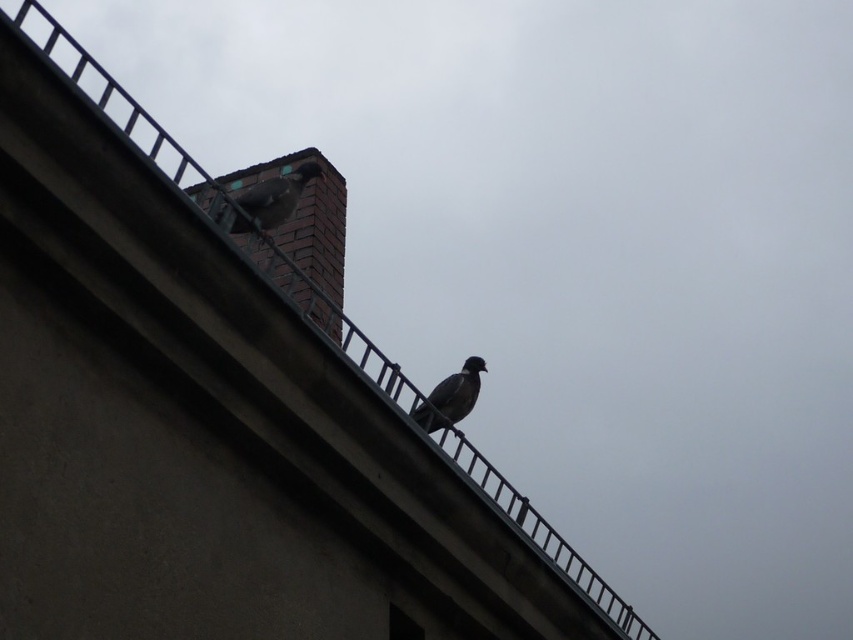
Question: Among these points, which one is farthest from the camera?

Choices:
 (A) (252, 218)
 (B) (422, 428)

Answer: (B)

Question: Observing the image, what is the correct spatial positioning of gray matte pigeon at upper center in reference to gray matte pigeon at center?

Choices:
 (A) above
 (B) below

Answer: (A)

Question: Where is gray matte pigeon at upper center located in relation to gray matte pigeon at center in the image?

Choices:
 (A) above
 (B) below

Answer: (A)

Question: Among these points, which one is nearest to the camera?

Choices:
 (A) (473, 365)
 (B) (257, 188)

Answer: (B)

Question: Is the position of gray matte pigeon at upper center more distant than that of gray matte pigeon at center?

Choices:
 (A) no
 (B) yes

Answer: (A)

Question: Which point is closer to the camera?

Choices:
 (A) (294, 180)
 (B) (442, 403)

Answer: (A)